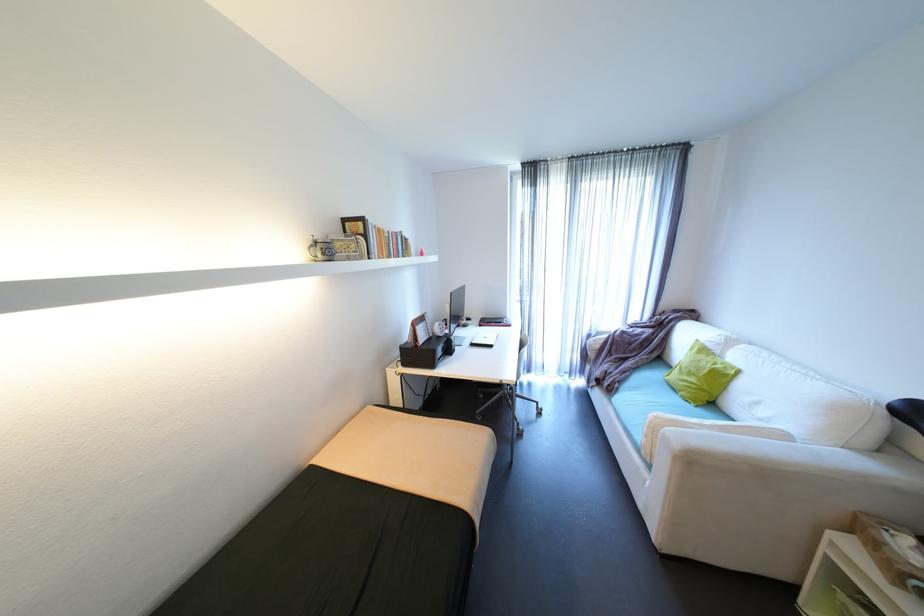
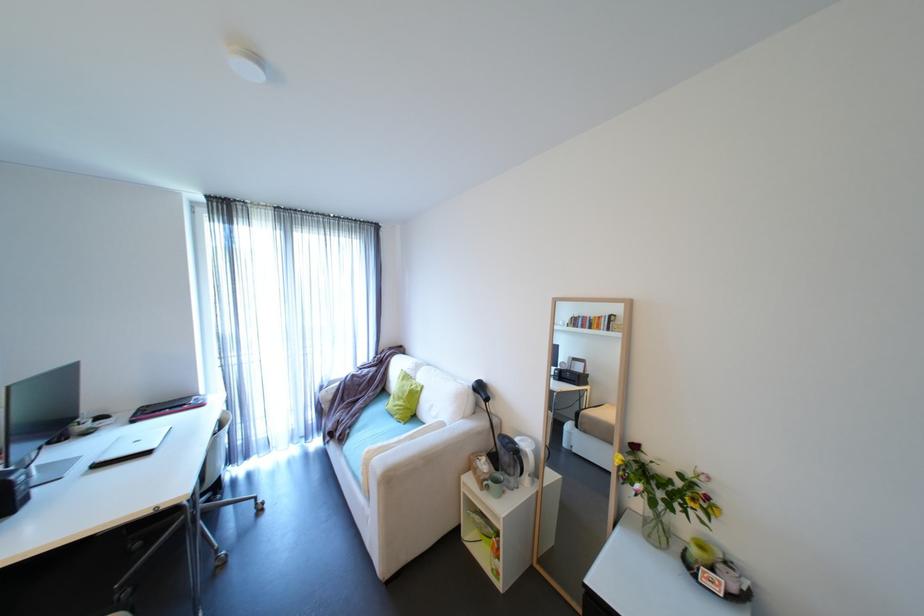
Locate, in the second image, the point that corresponds to point (492, 338) in the first image.

(144, 440)